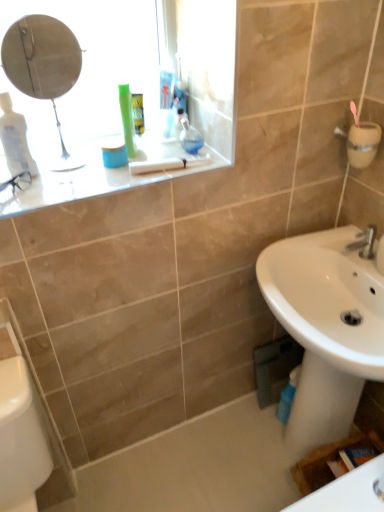
The image size is (384, 512). I want to click on free spot above white glossy counter top at upper left (from a real-world perspective), so click(x=117, y=168).